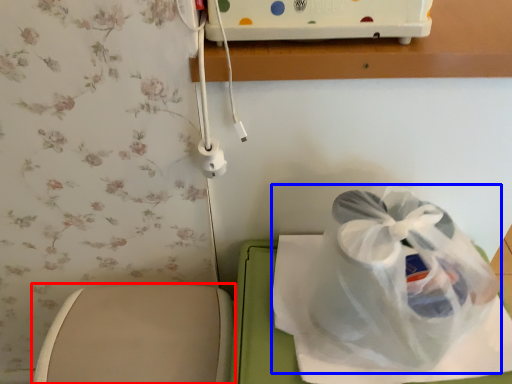
Question: Which object is closer to the camera taking this photo, toilet (highlighted by a red box) or plastic bag (highlighted by a blue box)?

Choices:
 (A) toilet
 (B) plastic bag

Answer: (B)